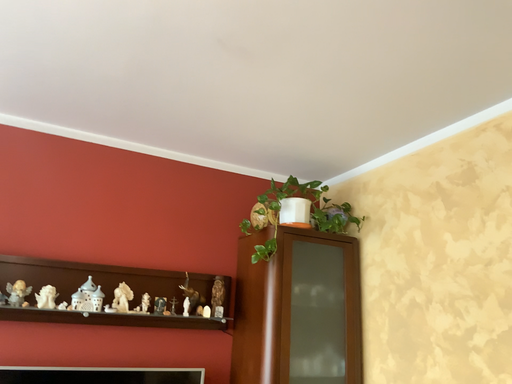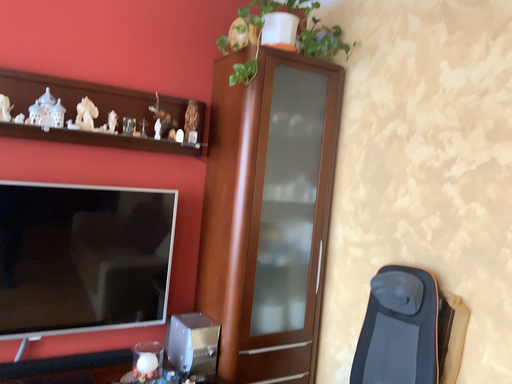
Question: How did the camera likely rotate when shooting the video?

Choices:
 (A) rotated downward
 (B) rotated upward

Answer: (A)